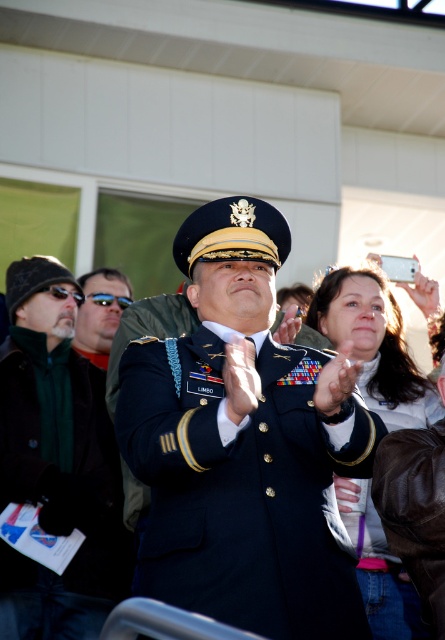
You are standing at the point marked as point (56,461) in the image. What object are you currently standing on?

You are standing on the dark green wool jacket at left.

You are standing at the center of the scene and want to move towards the dark green wool jacket at left. In which direction should you move?

The dark green wool jacket at left is located at point 0.723 on the x axis and 0.128 on the y axis. Since you are at the center, you should move to the left and slightly downward to reach it.

What is the exact coordinate of the navy blue uniform at center?

The navy blue uniform at center is located at point (245, 444).